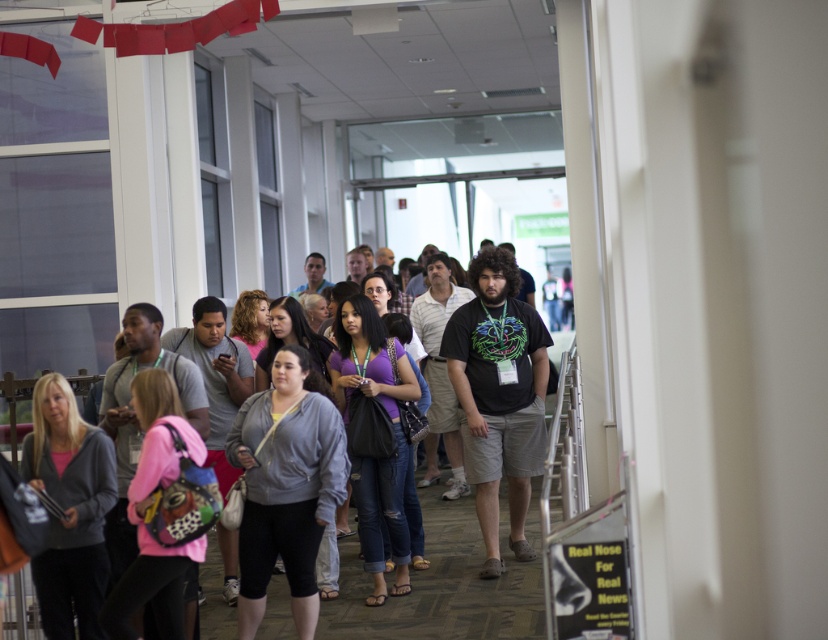
This screenshot has height=640, width=828. Describe the element at coordinates (441, 584) in the screenshot. I see `gray hoodie at center` at that location.

Is gray hoodie at center to the left of gray fleece jacket at center from the viewer's perspective?

No, gray hoodie at center is not to the left of gray fleece jacket at center.

Is point (412, 605) positioned behind point (314, 577)?

Yes, it is.

Locate an element on the screen. The height and width of the screenshot is (640, 828). gray hoodie at center is located at coordinates (441, 584).